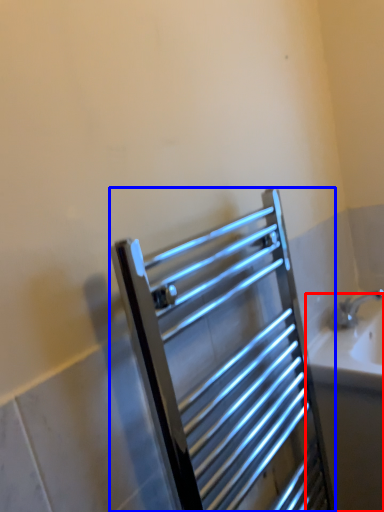
Question: Which of the following is the farthest to the observer, bath (highlighted by a red box) or screen door (highlighted by a blue box)?

Choices:
 (A) bath
 (B) screen door

Answer: (A)